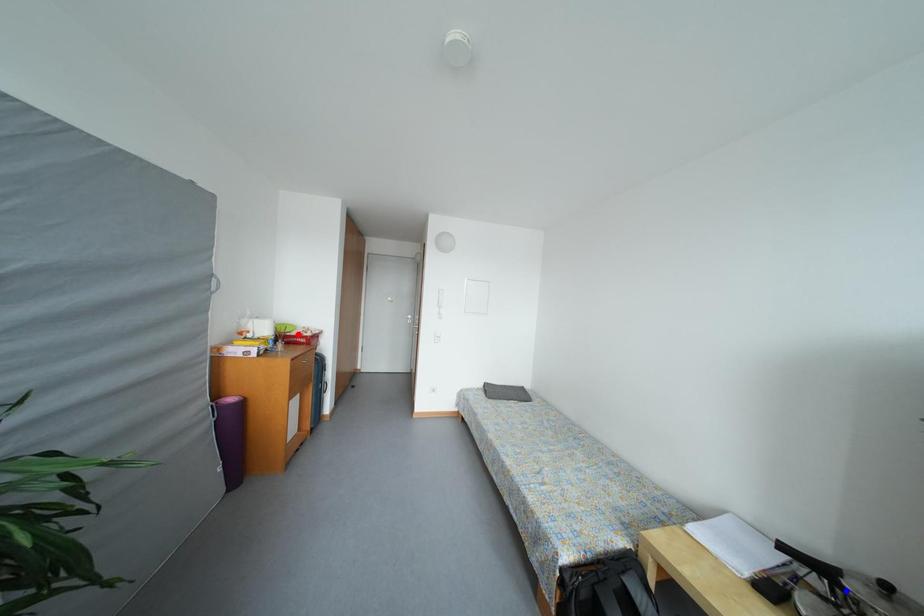
Question: Two points are marked on the image. Which point is closer to the camera?

Choices:
 (A) Blue point is closer.
 (B) Red point is closer.

Answer: (A)